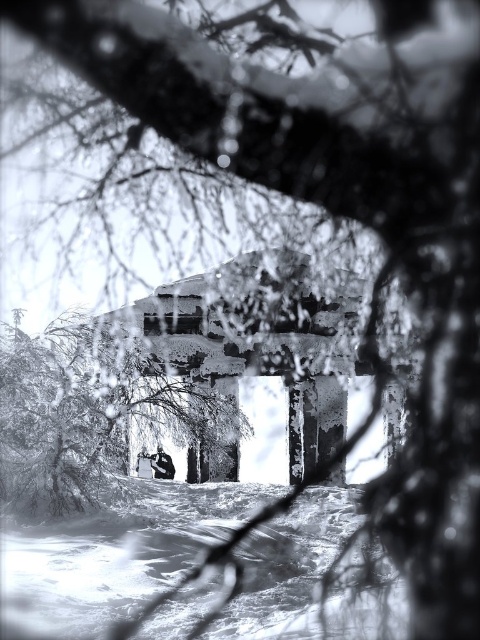
You are an explorer trying to reach the snow covered structure in the background. You see the white powdery snow at lower center and the dark gray fabric jacket at center. Which object is closer to you?

The white powdery snow at lower center is closer to you because it is in front of the dark gray fabric jacket at center.

You are standing in front of the snow covered structure and want to walk towards the point at the bottom of the image. Which point, point [103,472] or point [167,465], is closer to you?

Point [103,472] is closer to the viewer than point [167,465].